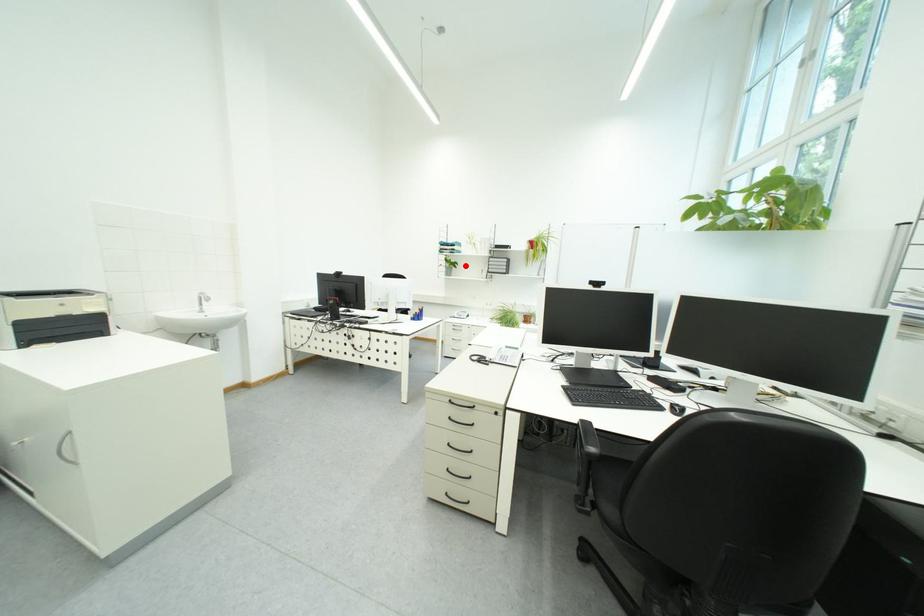
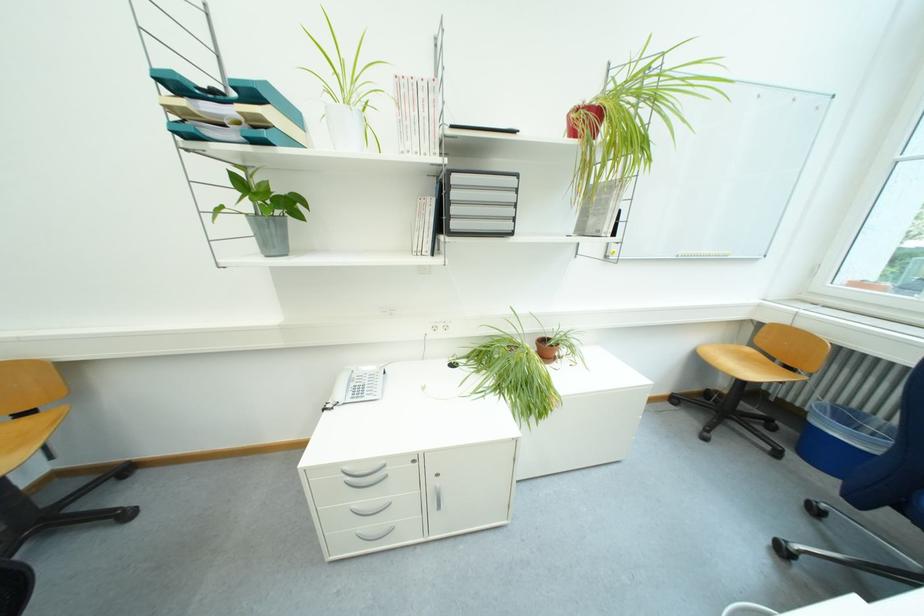
Locate, in the second image, the point that corresponds to the highlighted location in the first image.

(302, 206)